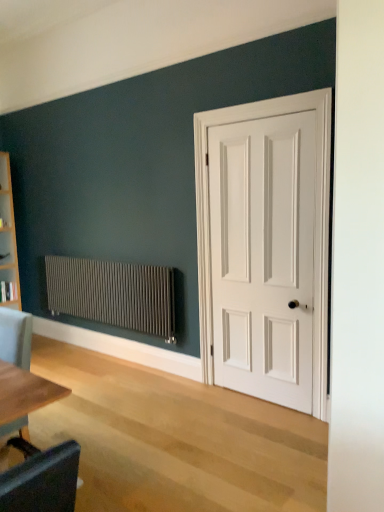
Question: Is matte gray radiator at left surrounding light gray fabric chair at lower left?

Choices:
 (A) yes
 (B) no

Answer: (B)

Question: Is matte gray radiator at left next to light gray fabric chair at lower left?

Choices:
 (A) yes
 (B) no

Answer: (B)

Question: Can you confirm if matte gray radiator at left is taller than light gray fabric chair at lower left?

Choices:
 (A) yes
 (B) no

Answer: (B)

Question: From the image's perspective, does matte gray radiator at left appear lower than light gray fabric chair at lower left?

Choices:
 (A) yes
 (B) no

Answer: (B)

Question: Would you say matte gray radiator at left is outside light gray fabric chair at lower left?

Choices:
 (A) yes
 (B) no

Answer: (A)

Question: Is matte gray radiator at left to the left or to the right of light gray fabric chair at lower left in the image?

Choices:
 (A) right
 (B) left

Answer: (A)

Question: Is matte gray radiator at left taller or shorter than light gray fabric chair at lower left?

Choices:
 (A) tall
 (B) short

Answer: (B)

Question: Looking at their shapes, would you say matte gray radiator at left is wider or thinner than light gray fabric chair at lower left?

Choices:
 (A) wide
 (B) thin

Answer: (B)

Question: Relative to light gray fabric chair at lower left, is matte gray radiator at left in front or behind?

Choices:
 (A) front
 (B) behind

Answer: (B)

Question: Considering the positions of matte gray radiator at left and white matte door at right in the image, is matte gray radiator at left taller or shorter than white matte door at right?

Choices:
 (A) tall
 (B) short

Answer: (B)

Question: Would you say matte gray radiator at left is to the left or to the right of white matte door at right in the picture?

Choices:
 (A) left
 (B) right

Answer: (A)

Question: Is matte gray radiator at left bigger or smaller than white matte door at right?

Choices:
 (A) big
 (B) small

Answer: (A)

Question: Is matte gray radiator at left situated inside white matte door at right or outside?

Choices:
 (A) inside
 (B) outside

Answer: (B)

Question: Looking at the image, does light gray fabric chair at lower left seem bigger or smaller compared to white matte door at right?

Choices:
 (A) big
 (B) small

Answer: (B)

Question: Does point (8, 424) appear closer or farther from the camera than point (200, 297)?

Choices:
 (A) closer
 (B) farther

Answer: (A)